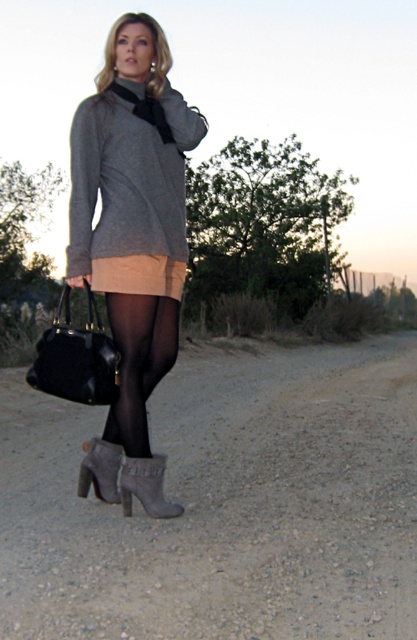
Can you confirm if gray gravel road at center is thinner than suede boot at lower center?

Incorrect, gray gravel road at center's width is not less than suede boot at lower center's.

Does gray gravel road at center appear on the left side of suede boot at lower center?

Incorrect, gray gravel road at center is not on the left side of suede boot at lower center.

Which is behind, point (49, 416) or point (148, 508)?

The point (49, 416) is behind.

The image size is (417, 640). In order to click on gray gravel road at center in this screenshot , I will do `click(225, 502)`.

Can you confirm if black sheer tights at lower center is thinner than suede boot at lower center?

No, black sheer tights at lower center is not thinner than suede boot at lower center.

Between point (145, 380) and point (175, 516), which one is positioned in front?

Point (175, 516) is more forward.

Between point (143, 369) and point (173, 516), which one is positioned behind?

The point (143, 369) is behind.

Where is `black sheer tights at lower center`? The image size is (417, 640). black sheer tights at lower center is located at coordinates (138, 362).

Does matte gray sweater at center have a greater height compared to black leather handbag at lower left?

Yes.

Looking at this image, is matte gray sweater at center below black leather handbag at lower left?

Incorrect, matte gray sweater at center is not positioned below black leather handbag at lower left.

Which is in front, point (165, 58) or point (87, 304)?

Point (165, 58) is more forward.

You are a GUI agent. You are given a task and a screenshot of the screen. Output one action in this format:
    pyautogui.click(x=<x>, y=<y>)
    Task: Click on the matte gray sweater at center
    The height and width of the screenshot is (640, 417).
    Given the screenshot: What is the action you would take?
    pyautogui.click(x=133, y=230)